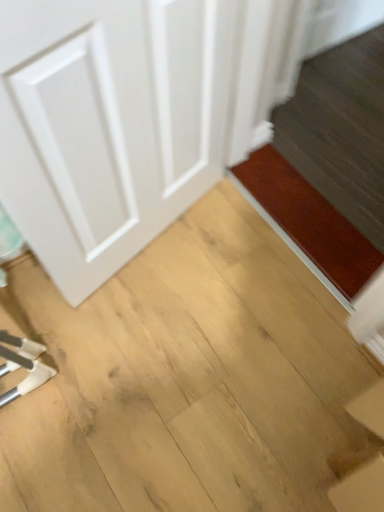
I want to click on vacant area on top of light brown wood at center (from a real-world perspective), so click(137, 345).